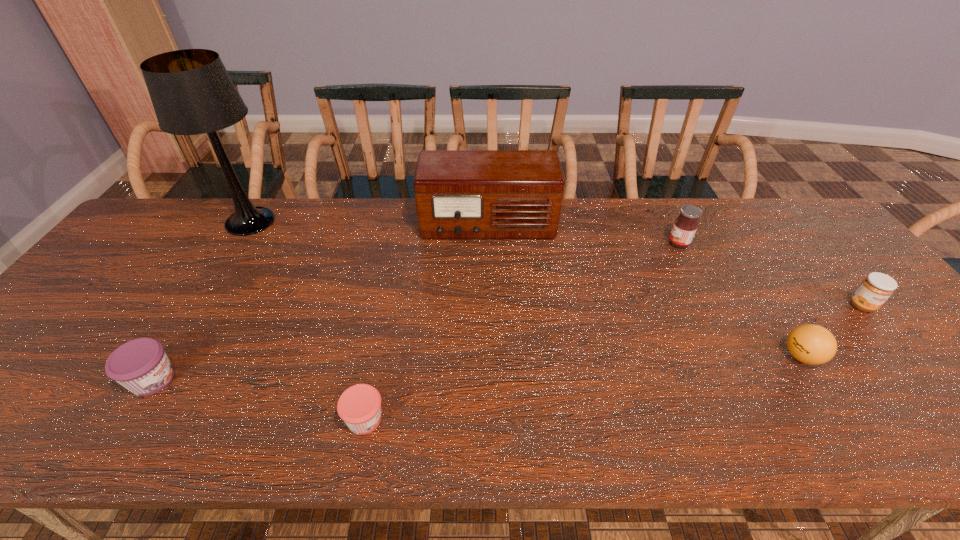
Identify the location of table lamp. The image size is (960, 540). (192, 93).

At what (x,y) coordinates should I click in order to perform the action: click on the second tallest object. Please return your answer as a coordinate pair (x, y). Looking at the image, I should click on (460, 194).

Where is `the fourth object from left to right`? The width and height of the screenshot is (960, 540). the fourth object from left to right is located at coordinates (460, 194).

Locate an element on the screen. the fifth shortest object is located at coordinates (685, 226).

Identify the location of the second jam from right to left. The image size is (960, 540). (685, 226).

You are a GUI agent. You are given a task and a screenshot of the screen. Output one action in this format:
    pyautogui.click(x=<x>, y=<y>)
    Task: Click on the fourth farthest object
    This screenshot has width=960, height=540.
    Given the screenshot: What is the action you would take?
    pyautogui.click(x=875, y=289)

This screenshot has height=540, width=960. What are the coordinates of `the rightmost jam` in the screenshot? It's located at (875, 289).

At what (x,y) coordinates should I click in order to perform the action: click on the second object from right to left. Please return your answer as a coordinate pair (x, y). The image size is (960, 540). Looking at the image, I should click on (811, 344).

Identify the location of the leftmost jam. This screenshot has width=960, height=540. (141, 365).

I want to click on the third jam from right to left, so click(359, 406).